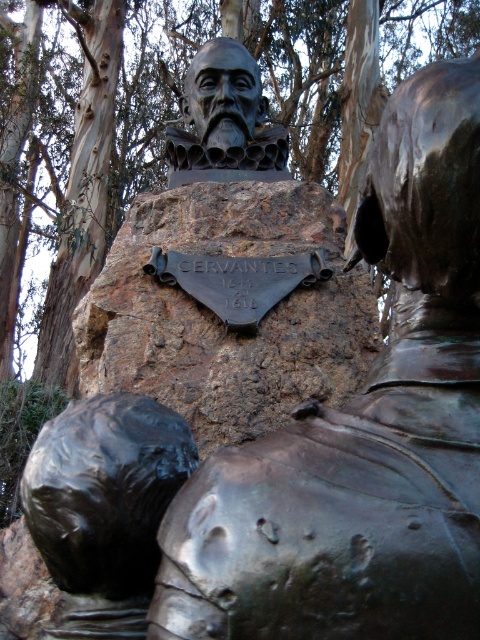
Can you confirm if shiny black helmet at lower left is smaller than bronze bust at center?

Indeed, shiny black helmet at lower left has a smaller size compared to bronze bust at center.

Can you confirm if shiny black helmet at lower left is shorter than bronze bust at center?

Yes.

The height and width of the screenshot is (640, 480). Find the location of `shiny black helmet at lower left`. shiny black helmet at lower left is located at coordinates (104, 508).

Is bronze statue at center to the right of brown rough stone at center from the viewer's perspective?

Indeed, bronze statue at center is positioned on the right side of brown rough stone at center.

What do you see at coordinates (362, 432) in the screenshot? This screenshot has width=480, height=640. I see `bronze statue at center` at bounding box center [362, 432].

Identify the location of bronze statue at center. (362, 432).

Can you confirm if brown rough stone at center is smaller than shiny black helmet at lower left?

No, brown rough stone at center is not smaller than shiny black helmet at lower left.

The image size is (480, 640). Find the location of `brown rough stone at center`. brown rough stone at center is located at coordinates (222, 317).

Is point (149, 236) positioned after point (71, 410)?

That is True.

You are a GUI agent. You are given a task and a screenshot of the screen. Output one action in this format:
    pyautogui.click(x=<x>, y=<y>)
    Task: Click on the brown rough stone at center
    The width and height of the screenshot is (480, 640).
    Given the screenshot: What is the action you would take?
    [222, 317]